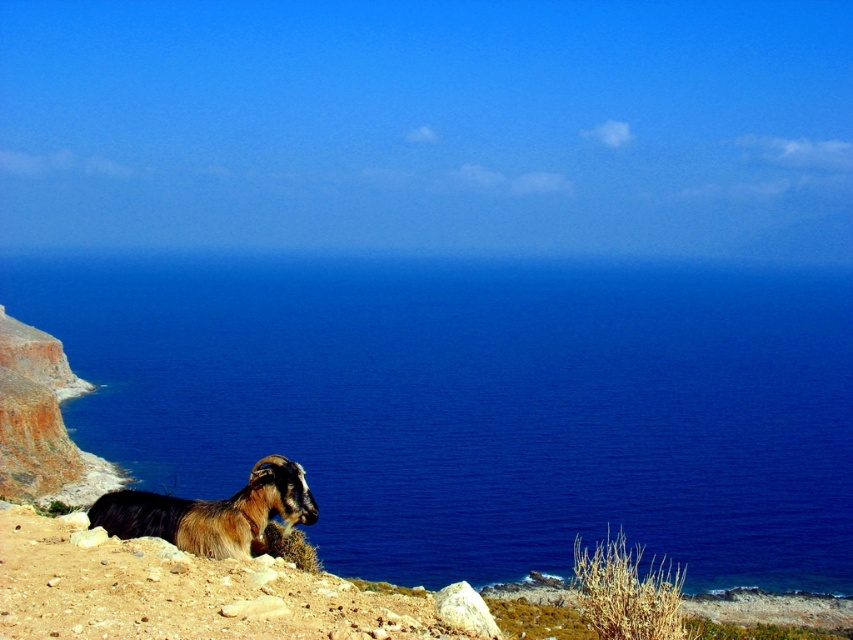
Question: Is blue water at lower left wider than brown woolen ram at lower left?

Choices:
 (A) no
 (B) yes

Answer: (B)

Question: Does blue water at lower left come behind brown woolen ram at lower left?

Choices:
 (A) yes
 (B) no

Answer: (A)

Question: Which of the following is the farthest from the observer?

Choices:
 (A) (592, 269)
 (B) (311, 502)

Answer: (A)

Question: Which of the following is the farthest from the observer?

Choices:
 (A) [x=569, y=346]
 (B) [x=128, y=497]

Answer: (A)

Question: Does blue water at lower left appear over brown woolen ram at lower left?

Choices:
 (A) no
 (B) yes

Answer: (B)